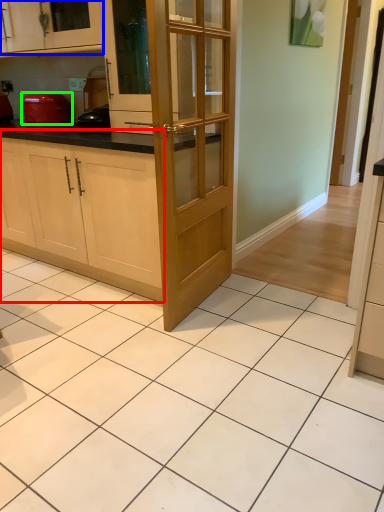
Question: Which object is the closest to the cabinetry (highlighted by a red box)? Choose among these: cabinetry (highlighted by a blue box) or kitchen appliance (highlighted by a green box).

Choices:
 (A) cabinetry
 (B) kitchen appliance

Answer: (B)